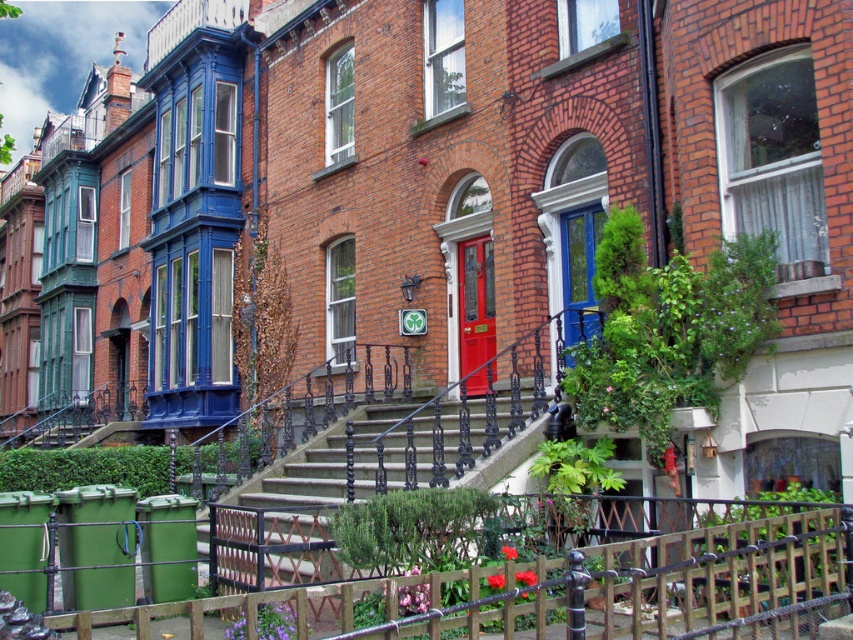
Based on the photo, which is more to the left, wooden fence at lower center or smooth concrete stairs at center?

smooth concrete stairs at center

Between point (608, 593) and point (229, 509), which one is positioned in front?

Point (608, 593) is in front.

Locate an element on the screen. Image resolution: width=853 pixels, height=640 pixels. wooden fence at lower center is located at coordinates (567, 589).

Does wooden fence at lower center appear on the right side of red glossy door at center?

No, wooden fence at lower center is not to the right of red glossy door at center.

Is wooden fence at lower center thinner than red glossy door at center?

Yes, wooden fence at lower center is thinner than red glossy door at center.

Does point (264, 600) come closer to viewer compared to point (460, 257)?

That is True.

I want to click on wooden fence at lower center, so [x=567, y=589].

Can you confirm if smooth concrete stairs at center is positioned below matte blue door at center?

Yes, smooth concrete stairs at center is below matte blue door at center.

Is smooth concrete stairs at center positioned before matte blue door at center?

Yes.

Who is more forward, (325, 524) or (579, 216)?

Positioned in front is point (325, 524).

I want to click on smooth concrete stairs at center, so click(x=354, y=484).